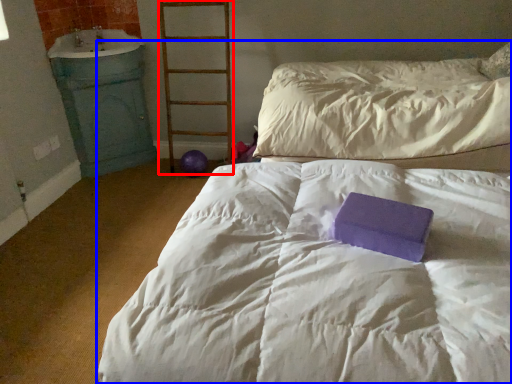
Question: Which of the following is the closest to the observer, ladder (highlighted by a red box) or bed (highlighted by a blue box)?

Choices:
 (A) ladder
 (B) bed

Answer: (B)